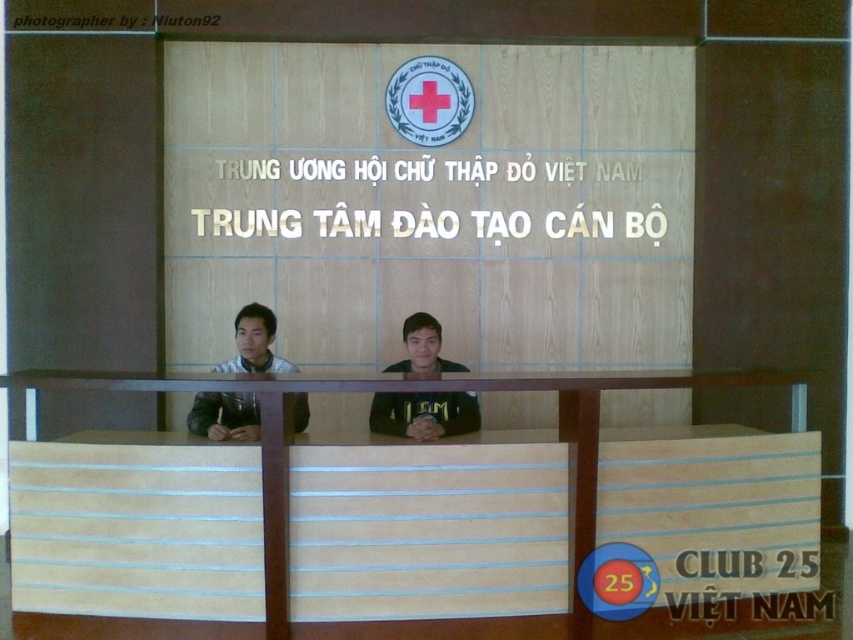
What is located at the coordinates point (419,388) in the image?

The point (419,388) indicates light brown wood at center.

You are a visitor approaching the reception desk at the Vietnam Red Cross Central Training Center. You see the light brown wood at center and the black matte shirt at center. Which object is closer to the floor?

The light brown wood at center is below the black matte shirt at center, so it is closer to the floor.

You are standing in front of the reception desk at the Vietnam Red Cross Central Training Center. You notice two points marked on the desk. The first point is at coordinate (x=434, y=433) and the second is at (x=202, y=400). If you were to walk from the first point to the second, would you be moving towards the staff members or away from them?

Since point (x=434, y=433) is in front of point (x=202, y=400), moving from the first to the second point would mean moving away from the staff members who are seated behind the desk.